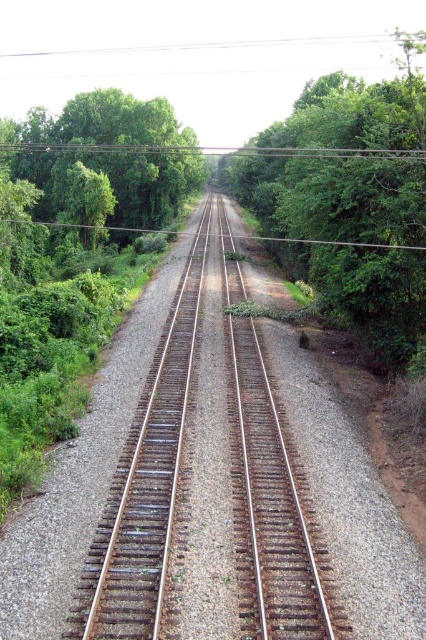
Question: From the image, what is the correct spatial relationship of rusty metal tracks at center in relation to green leafy tree at left?

Choices:
 (A) right
 (B) left

Answer: (A)

Question: Which object is closer to the camera taking this photo?

Choices:
 (A) green leafy tree at right
 (B) green leafy tree at left
 (C) rusty metal tracks at center

Answer: (C)

Question: Which object is farther from the camera taking this photo?

Choices:
 (A) rusty metal tracks at center
 (B) green leafy tree at left

Answer: (B)

Question: Does rusty metal tracks at center appear on the left side of green leafy tree at right?

Choices:
 (A) yes
 (B) no

Answer: (A)

Question: Does green leafy tree at right have a larger size compared to green leafy tree at left?

Choices:
 (A) no
 (B) yes

Answer: (B)

Question: Estimate the real-world distances between objects in this image. Which object is farther from the rusty metal tracks at center?

Choices:
 (A) green leafy tree at left
 (B) green leafy tree at right

Answer: (A)